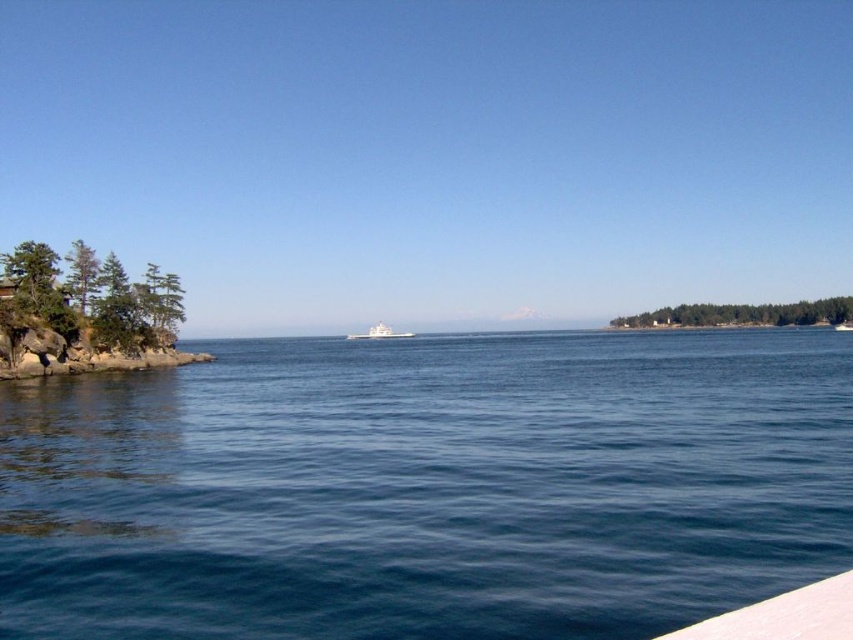
Question: Based on their relative distances, which object is farther from the green textured rocks at left?

Choices:
 (A) white glossy boat at center
 (B) blue water at center

Answer: (A)

Question: Is blue water at center further to the viewer compared to white glossy boat at center?

Choices:
 (A) no
 (B) yes

Answer: (A)

Question: Which object is closer to the camera taking this photo?

Choices:
 (A) white glossy boat at center
 (B) blue water at center
 (C) green textured rocks at left

Answer: (B)

Question: Does blue water at center appear over green textured rocks at left?

Choices:
 (A) yes
 (B) no

Answer: (B)

Question: Can you confirm if blue water at center is bigger than white glossy boat at center?

Choices:
 (A) yes
 (B) no

Answer: (A)

Question: Which of the following is the closest to the observer?

Choices:
 (A) blue water at center
 (B) white glossy boat at center

Answer: (A)